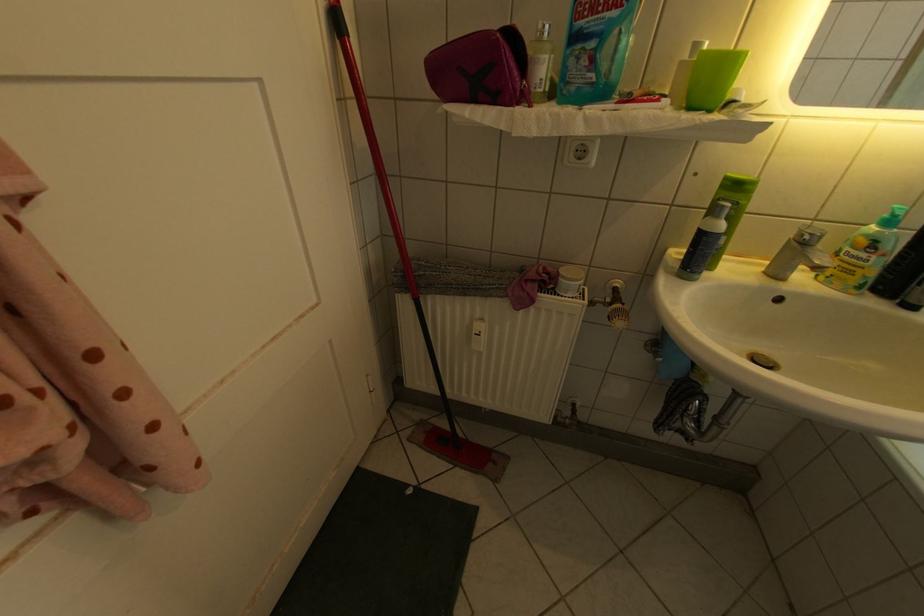
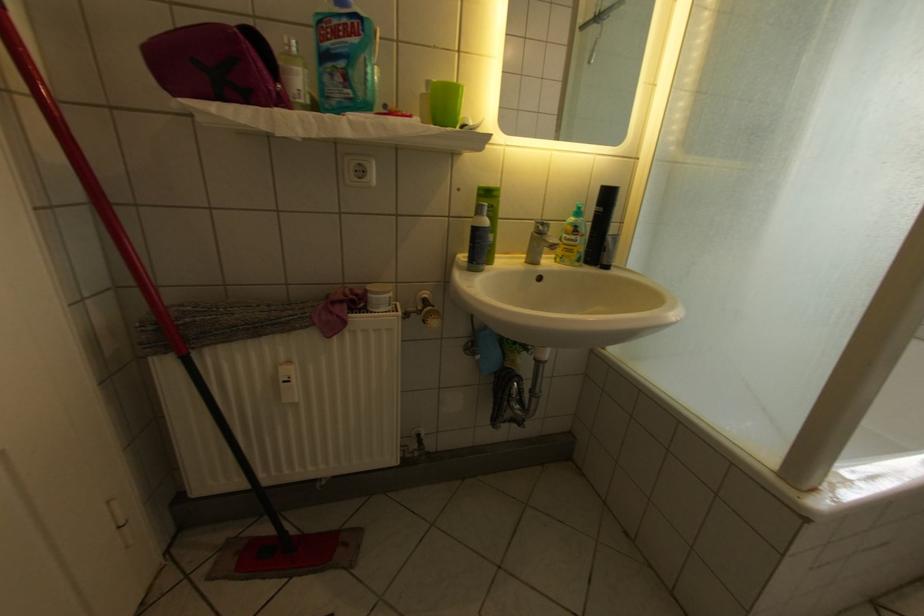
The point at (774,270) is marked in the first image. Where is the corresponding point in the second image?

(536, 262)